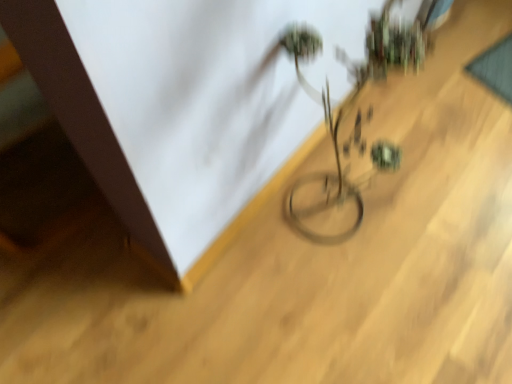
Locate an element on the screen. Image resolution: width=512 pixels, height=384 pixels. free spot behind green matte houseplant at center is located at coordinates pos(347,149).